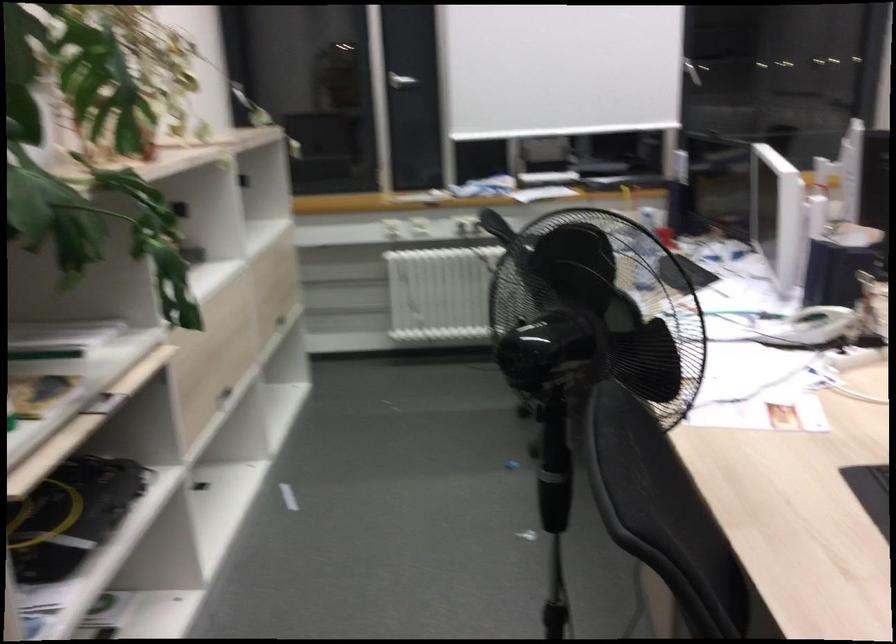
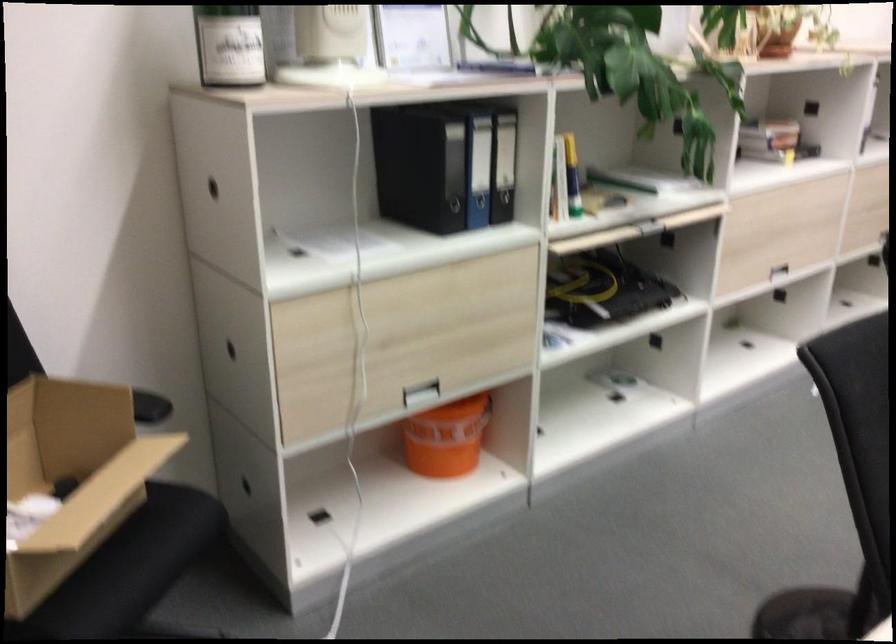
Find the pixel in the second image that matches [229,389] in the first image.

(771, 266)